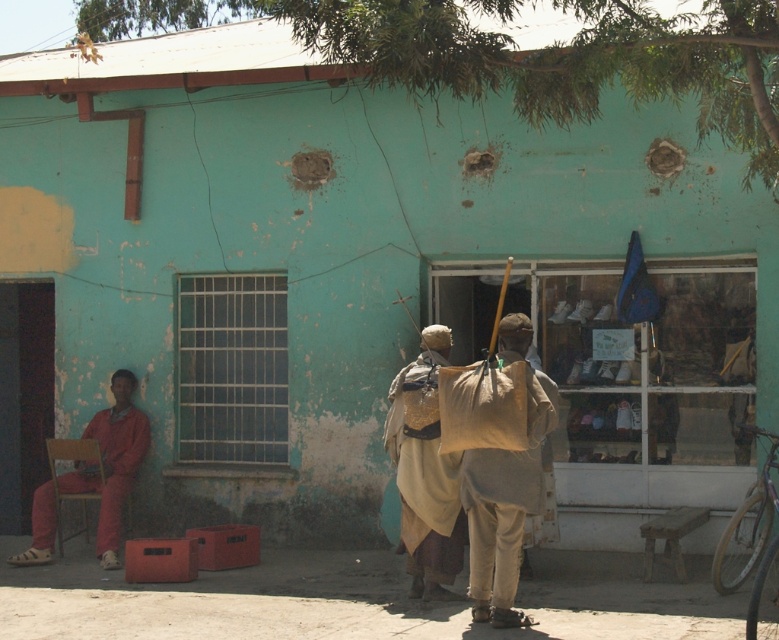
Question: Which is farther from the matte orange jumpsuit at left?

Choices:
 (A) beige sack at center
 (B) beige fabric bag at center

Answer: (A)

Question: Is beige sack at center thinner than matte orange jumpsuit at left?

Choices:
 (A) no
 (B) yes

Answer: (B)

Question: Which object appears farthest from the camera in this image?

Choices:
 (A) beige fabric bag at center
 (B) beige sack at center
 (C) matte orange jumpsuit at left

Answer: (C)

Question: Can you confirm if beige fabric bag at center is positioned below matte orange jumpsuit at left?

Choices:
 (A) yes
 (B) no

Answer: (B)

Question: Which object is farther from the camera taking this photo?

Choices:
 (A) matte orange jumpsuit at left
 (B) beige sack at center

Answer: (A)

Question: Does beige sack at center appear on the left side of matte orange jumpsuit at left?

Choices:
 (A) yes
 (B) no

Answer: (B)